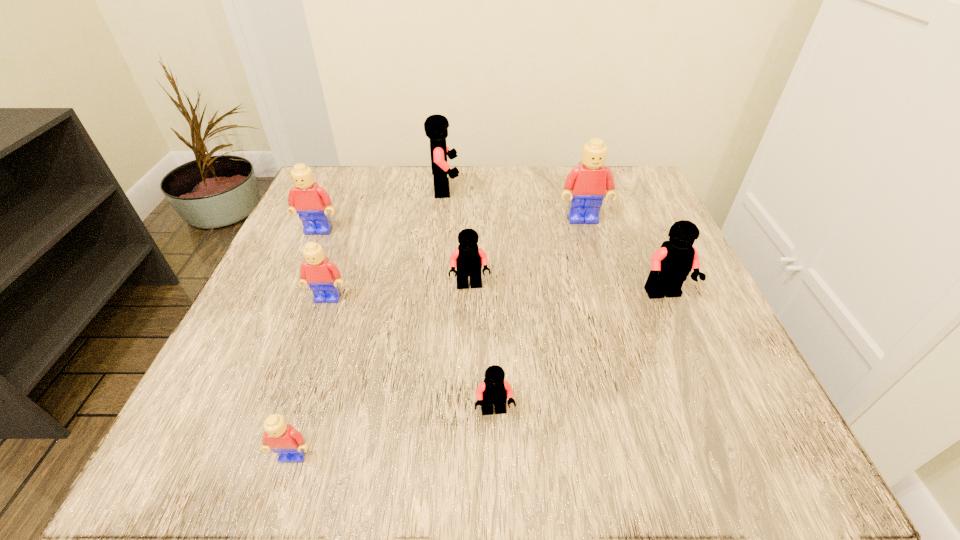
Locate an element on the screen. object located in the far right corner section of the desktop is located at coordinates (587, 184).

You are a GUI agent. You are given a task and a screenshot of the screen. Output one action in this format:
    pyautogui.click(x=<x>, y=<y>)
    Task: Click on the vacant area at the far edge
    The image size is (960, 540).
    Given the screenshot: What is the action you would take?
    pyautogui.click(x=390, y=196)

Locate an element on the screen. Image resolution: width=960 pixels, height=540 pixels. free space at the near edge is located at coordinates (407, 444).

At what (x,y) coordinates should I click in order to perform the action: click on free spot at the left edge of the desktop. Please return your answer as a coordinate pair (x, y). The image size is (960, 540). Looking at the image, I should click on point(244,324).

Locate an element on the screen. vacant space at the right edge of the desktop is located at coordinates (741, 369).

In the image, there is a desktop. What are the coordinates of `vacant space at the far left corner` in the screenshot? It's located at (334, 194).

The image size is (960, 540). In the image, there is a desktop. Identify the location of vacant area at the far right corner. (643, 173).

This screenshot has height=540, width=960. Identify the location of vacant area between the farthest Lego and the second smallest yellow Lego. tap(387, 244).

Find the location of `vacant point located between the second nearest Lego and the second biggest yellow Lego`. vacant point located between the second nearest Lego and the second biggest yellow Lego is located at coordinates (407, 321).

The width and height of the screenshot is (960, 540). Identify the location of vacant space in between the farthest object and the second biggest yellow Lego. tap(382, 210).